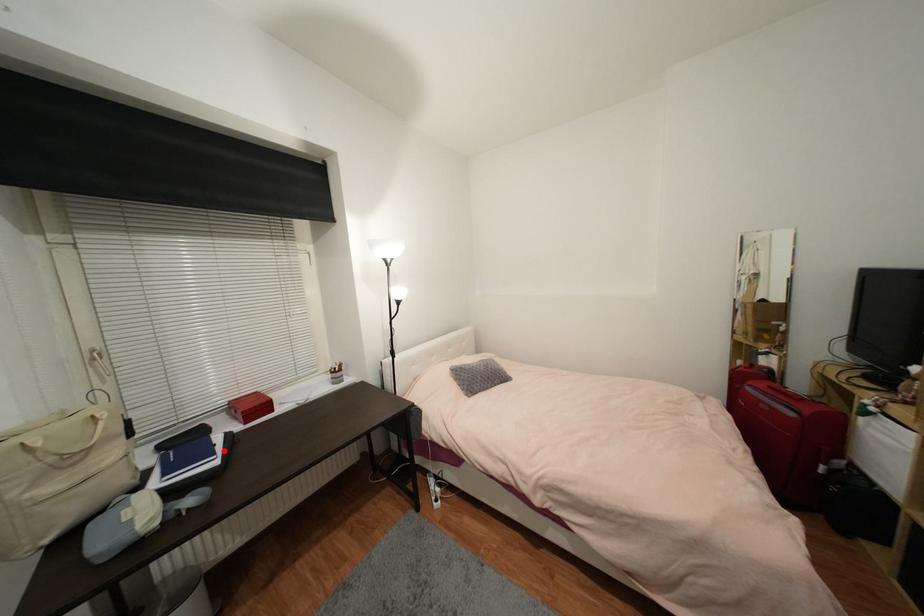
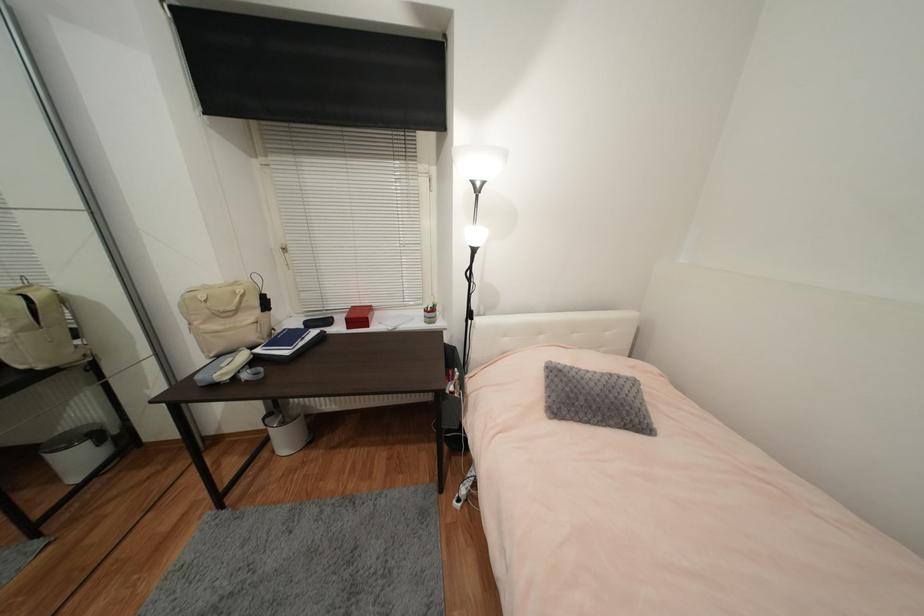
The point at the highlighted location is marked in the first image. Where is the corresponding point in the second image?

(306, 344)